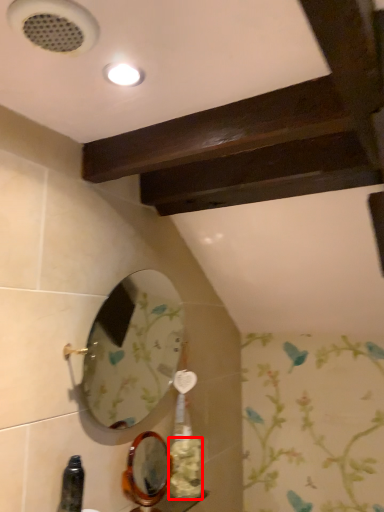
Question: From the image, what is the correct spatial relationship of flower (annotated by the red box) in relation to mirror?

Choices:
 (A) right
 (B) left

Answer: (A)